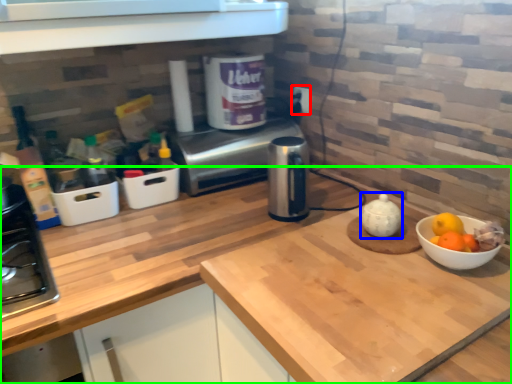
Question: Which is farther away from electric outlet (highlighted by a red box)? tea pot (highlighted by a blue box) or countertop (highlighted by a green box)?

Choices:
 (A) tea pot
 (B) countertop

Answer: (B)